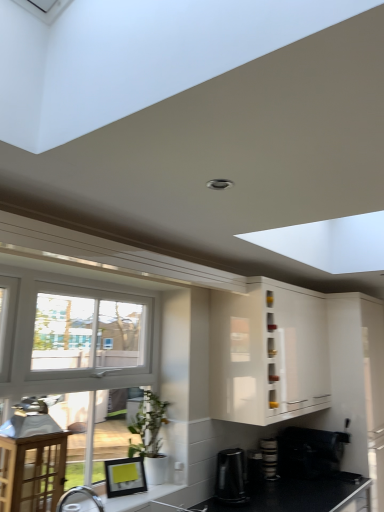
This screenshot has width=384, height=512. I want to click on vacant point above white glossy countertop at lower left (from a real-world perspective), so click(x=138, y=492).